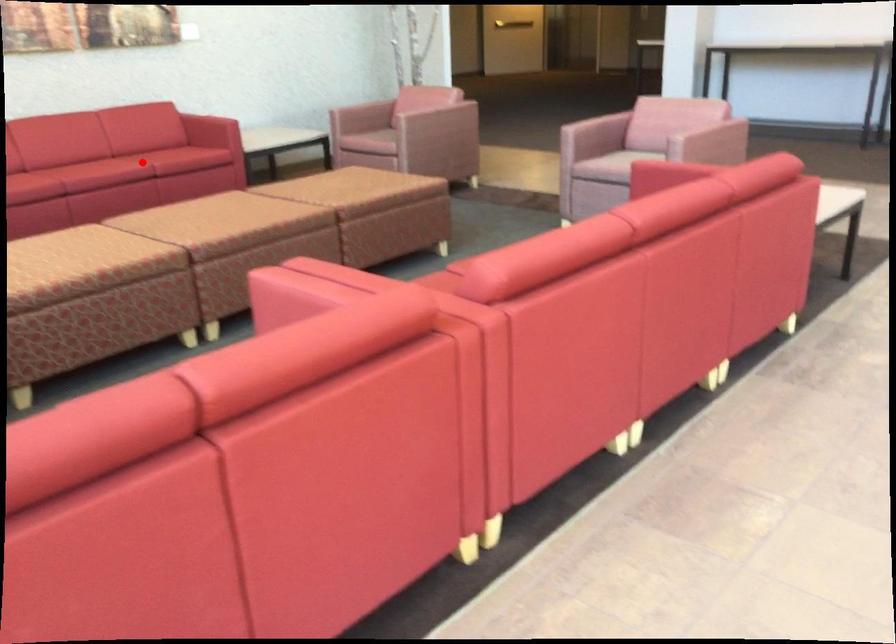
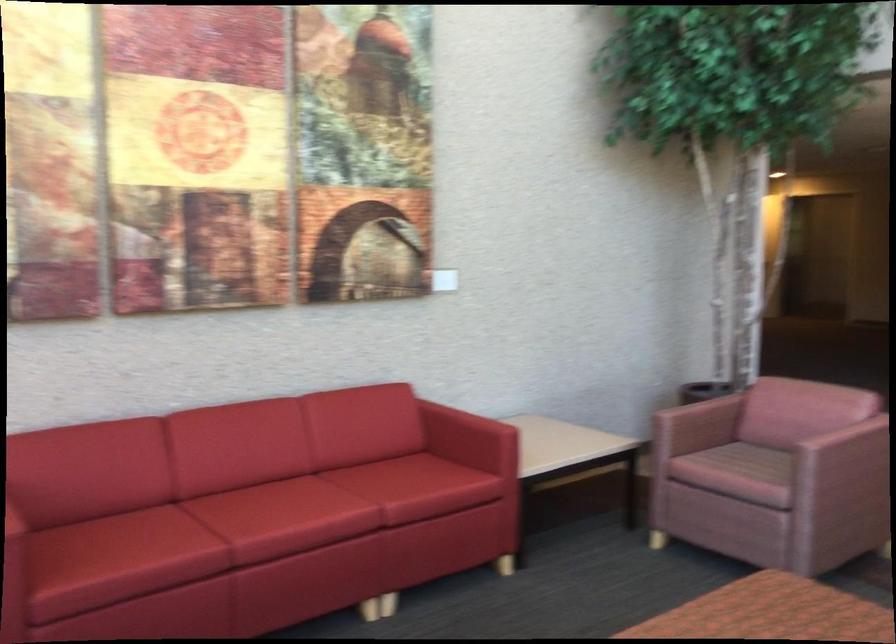
Question: A red point is marked in image1. In image2, is the corresponding 3D point closer to the camera or farther? Reply with the corresponding letter.

Choices:
 (A) The corresponding 3D point is closer.
 (B) The corresponding 3D point is farther.

Answer: (A)